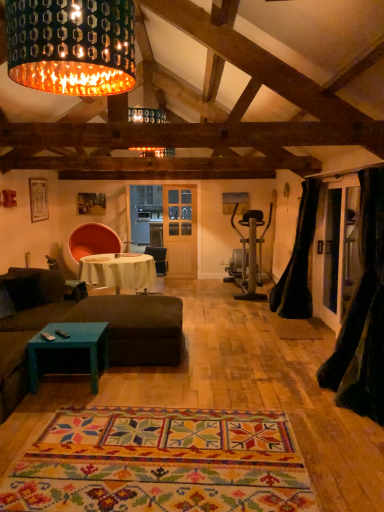
Question: Is brown fabric couch at lower left at the back of dark brown fabric couch at center?

Choices:
 (A) no
 (B) yes

Answer: (B)

Question: Is dark brown fabric couch at center further to the viewer compared to brown fabric couch at lower left?

Choices:
 (A) no
 (B) yes

Answer: (A)

Question: Considering the relative sizes of dark brown fabric couch at center and brown fabric couch at lower left in the image provided, is dark brown fabric couch at center bigger than brown fabric couch at lower left?

Choices:
 (A) no
 (B) yes

Answer: (B)

Question: Can you see dark brown fabric couch at center touching brown fabric couch at lower left?

Choices:
 (A) no
 (B) yes

Answer: (A)

Question: From the image's perspective, is dark brown fabric couch at center on top of brown fabric couch at lower left?

Choices:
 (A) yes
 (B) no

Answer: (B)

Question: From a real-world perspective, relative to metallic perforated shade at upper center, is multicolored woven rug at center vertically above or below?

Choices:
 (A) below
 (B) above

Answer: (A)

Question: Looking at the image, does multicolored woven rug at center seem bigger or smaller compared to metallic perforated shade at upper center?

Choices:
 (A) big
 (B) small

Answer: (A)

Question: Is multicolored woven rug at center in front of or behind metallic perforated shade at upper center in the image?

Choices:
 (A) front
 (B) behind

Answer: (B)

Question: Based on their positions, is multicolored woven rug at center located to the left or right of metallic perforated shade at upper center?

Choices:
 (A) left
 (B) right

Answer: (B)

Question: From the image's perspective, is black velvet curtain at right, arranged as the 2th curtain when viewed from the back, above or below white cloth-covered table at center?

Choices:
 (A) below
 (B) above

Answer: (B)

Question: From their relative heights in the image, would you say black velvet curtain at right, arranged as the 1th curtain when viewed from the front, is taller or shorter than white cloth-covered table at center?

Choices:
 (A) short
 (B) tall

Answer: (B)

Question: Is black velvet curtain at right, arranged as the 2th curtain when viewed from the back, to the left or to the right of white cloth-covered table at center in the image?

Choices:
 (A) left
 (B) right

Answer: (B)

Question: Is black velvet curtain at right, arranged as the 2th curtain when viewed from the back, spatially inside white cloth-covered table at center, or outside of it?

Choices:
 (A) outside
 (B) inside

Answer: (A)

Question: Is white cloth-covered table at center to the left or to the right of black velvet curtain at right, arranged as the 1th curtain when viewed from the front, in the image?

Choices:
 (A) right
 (B) left

Answer: (B)

Question: Considering the positions of white cloth-covered table at center and black velvet curtain at right, arranged as the 1th curtain when viewed from the front, in the image, is white cloth-covered table at center bigger or smaller than black velvet curtain at right, arranged as the 1th curtain when viewed from the front,?

Choices:
 (A) small
 (B) big

Answer: (B)